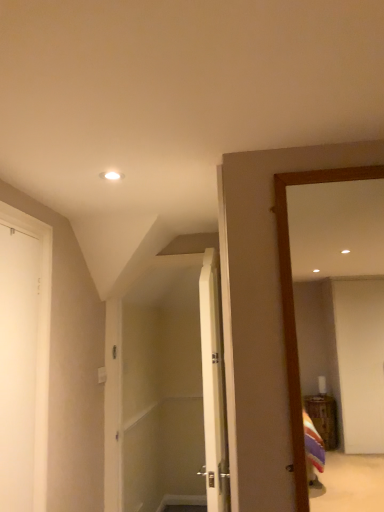
Measure the distance between white matte door at left, positioned as the 2th door in right-to-left order, and camera.

white matte door at left, positioned as the 2th door in right-to-left order, and camera are 4.67 feet apart.

Describe the element at coordinates (293, 302) in the screenshot. I see `wooden mirror at right` at that location.

Identify the location of wooden mirror at right. This screenshot has height=512, width=384. (293, 302).

You are a GUI agent. You are given a task and a screenshot of the screen. Output one action in this format:
    pyautogui.click(x=<x>, y=<y>)
    Task: Click on the white matte door at left, acting as the second door starting from the back
    This screenshot has height=512, width=384.
    Given the screenshot: What is the action you would take?
    pyautogui.click(x=18, y=366)

From a real-world perspective, which object stands above the other?

In real-world perspective, wooden mirror at right is above.

From the picture: Which object is wider, white wood door at center, the 1th door from the right, or wooden mirror at right?

With larger width is white wood door at center, the 1th door from the right.

Is white wood door at center, which is the 2th door from front to back, taller than wooden mirror at right?

Indeed, white wood door at center, which is the 2th door from front to back, has a greater height compared to wooden mirror at right.

Is white wood door at center, the 1th door from the right, further to the viewer compared to wooden mirror at right?

Yes.

Who is taller, white wood door at center, positioned as the second door in left-to-right order, or white matte door at left, which is the 1th door from front to back?

white wood door at center, positioned as the second door in left-to-right order.

Can we say white wood door at center, which is the first door in back-to-front order, lies outside white matte door at left, the 1th door viewed from the left?

Yes, white wood door at center, which is the first door in back-to-front order, is not within white matte door at left, the 1th door viewed from the left.

From the image's perspective, would you say white wood door at center, the 1th door from the right, is positioned over white matte door at left, acting as the second door starting from the back?

Incorrect, from the image's perspective, white wood door at center, the 1th door from the right, is lower than white matte door at left, acting as the second door starting from the back.

At what (x,y) coordinates should I click in order to perform the action: click on door that appears in front of the white wood door at center, positioned as the second door in left-to-right order. Please return your answer as a coordinate pair (x, y). This screenshot has height=512, width=384. Looking at the image, I should click on (18, 366).

Does white matte door at left, positioned as the 2th door in right-to-left order, have a larger size compared to wooden mirror at right?

Actually, white matte door at left, positioned as the 2th door in right-to-left order, might be smaller than wooden mirror at right.

Is point (35, 294) more distant than point (298, 449)?

Yes, point (35, 294) is farther from viewer.

Is wooden mirror at right a part of white matte door at left, the 1th door viewed from the left?

No, wooden mirror at right is not surrounded by white matte door at left, the 1th door viewed from the left.

Is wooden mirror at right positioned with its back to white wood door at center, which is the first door in back-to-front order?

No.

Between wooden mirror at right and white wood door at center, which is the 2th door from front to back, which one appears on the right side from the viewer's perspective?

Positioned to the right is wooden mirror at right.

Considering the positions of points (293, 426) and (214, 348), is point (293, 426) farther from camera compared to point (214, 348)?

No, it is not.

From the image's perspective, which is above, wooden mirror at right or white wood door at center, positioned as the second door in left-to-right order?

wooden mirror at right, from the image's perspective.

Does wooden mirror at right have a lesser width compared to white matte door at left, the 1th door viewed from the left?

Incorrect, the width of wooden mirror at right is not less than that of white matte door at left, the 1th door viewed from the left.

Find the location of a particular element. mirror located in front of the white matte door at left, the 1th door viewed from the left is located at coordinates (293, 302).

Would you say wooden mirror at right is outside white matte door at left, which is the 1th door from front to back?

wooden mirror at right lies outside white matte door at left, which is the 1th door from front to back,'s area.

In terms of size, does wooden mirror at right appear bigger or smaller than white matte door at left, acting as the second door starting from the back?

Considering their sizes, wooden mirror at right takes up more space than white matte door at left, acting as the second door starting from the back.

Is point (31, 301) closer or farther from the camera than point (217, 510)?

Point (31, 301).

Locate an element on the screen. The height and width of the screenshot is (512, 384). door above the white wood door at center, positioned as the second door in left-to-right order (from a real-world perspective) is located at coordinates (18, 366).

Considering the sizes of objects white matte door at left, acting as the second door starting from the back, and white wood door at center, positioned as the second door in left-to-right order, in the image provided, who is taller, white matte door at left, acting as the second door starting from the back, or white wood door at center, positioned as the second door in left-to-right order,?

white wood door at center, positioned as the second door in left-to-right order.

Could you measure the distance between white matte door at left, positioned as the 2th door in right-to-left order, and white wood door at center, which is the 2th door from front to back?

The distance of white matte door at left, positioned as the 2th door in right-to-left order, from white wood door at center, which is the 2th door from front to back, is 28.55 inches.

You are a GUI agent. You are given a task and a screenshot of the screen. Output one action in this format:
    pyautogui.click(x=<x>, y=<y>)
    Task: Click on the 1st door to the left of the wooden mirror at right, counting from the anchor's position
    The width and height of the screenshot is (384, 512).
    Given the screenshot: What is the action you would take?
    pyautogui.click(x=213, y=386)

What are the coordinates of `door above the white wood door at center, which is the first door in back-to-front order (from a real-world perspective)` in the screenshot? It's located at (18, 366).

Which object lies nearer to the anchor point wooden mirror at right, white wood door at center, positioned as the second door in left-to-right order, or white matte door at left, the 1th door viewed from the left?

white wood door at center, positioned as the second door in left-to-right order.

From the picture: From the image, which object appears to be nearer to white wood door at center, the 1th door from the right, wooden mirror at right or white matte door at left, which is the 1th door from front to back?

The object closer to white wood door at center, the 1th door from the right, is wooden mirror at right.

Looking at the image, which one is located further to white wood door at center, the 1th door from the right, white matte door at left, the 1th door viewed from the left, or wooden mirror at right?

white matte door at left, the 1th door viewed from the left.

Which object lies nearer to the anchor point white matte door at left, the 1th door viewed from the left, white wood door at center, positioned as the second door in left-to-right order, or wooden mirror at right?

white wood door at center, positioned as the second door in left-to-right order, lies closer to white matte door at left, the 1th door viewed from the left, than the other object.

Considering their positions, is wooden mirror at right positioned closer to white matte door at left, the 1th door viewed from the left, than white wood door at center, positioned as the second door in left-to-right order?

white wood door at center, positioned as the second door in left-to-right order, is closer to white matte door at left, the 1th door viewed from the left.

Based on their spatial positions, is white matte door at left, acting as the second door starting from the back, or white wood door at center, positioned as the second door in left-to-right order, closer to wooden mirror at right?

white wood door at center, positioned as the second door in left-to-right order, is closer to wooden mirror at right.

At what (x,y) coordinates should I click in order to perform the action: click on door situated between white matte door at left, which is the 1th door from front to back, and wooden mirror at right from left to right. Please return your answer as a coordinate pair (x, y). Looking at the image, I should click on (213, 386).